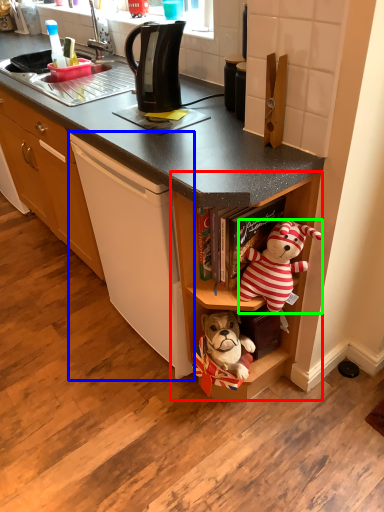
Question: Which is farther away from shelf (highlighted by a red box)? cording machine (highlighted by a blue box) or teddy bear (highlighted by a green box)?

Choices:
 (A) cording machine
 (B) teddy bear

Answer: (A)